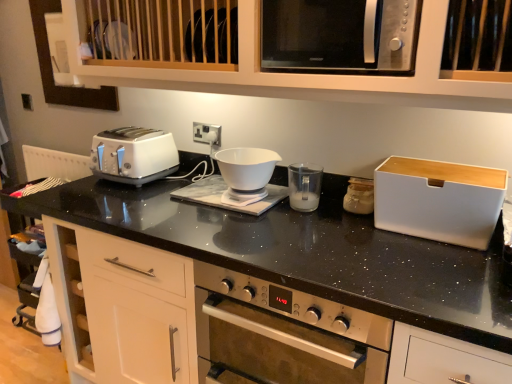
Question: From a real-world perspective, does white plastic bread bin at right, the 3th appliance when ordered from left to right, sit lower than matte glass jar at center-right, the second appliance when ordered from left to right?

Choices:
 (A) no
 (B) yes

Answer: (A)

Question: From the image's perspective, does white plastic bread bin at right, marked as the first appliance in a right-to-left arrangement, appear higher than matte glass jar at center-right, the second appliance when ordered from left to right?

Choices:
 (A) no
 (B) yes

Answer: (A)

Question: From the image's perspective, is white plastic bread bin at right, the 3th appliance when ordered from left to right, below matte glass jar at center-right, acting as the second appliance starting from the right?

Choices:
 (A) no
 (B) yes

Answer: (B)

Question: Could matte glass jar at center-right, acting as the second appliance starting from the right, be considered to be inside white plastic bread bin at right, the 3th appliance when ordered from left to right?

Choices:
 (A) no
 (B) yes

Answer: (A)

Question: Is white plastic bread bin at right, the 3th appliance when ordered from left to right, positioned behind matte glass jar at center-right, the second appliance when ordered from left to right?

Choices:
 (A) yes
 (B) no

Answer: (B)

Question: Is white plastic bread bin at right, the 3th appliance when ordered from left to right, shorter than matte glass jar at center-right, acting as the second appliance starting from the right?

Choices:
 (A) no
 (B) yes

Answer: (A)

Question: Can you confirm if white glossy bowl at center is bigger than white plastic cup at center, arranged as the first appliance when viewed from the left?

Choices:
 (A) yes
 (B) no

Answer: (A)

Question: From the image's perspective, does white glossy bowl at center appear lower than white plastic cup at center, arranged as the first appliance when viewed from the left?

Choices:
 (A) no
 (B) yes

Answer: (A)

Question: Can you confirm if white glossy bowl at center is smaller than white plastic cup at center, arranged as the first appliance when viewed from the left?

Choices:
 (A) no
 (B) yes

Answer: (A)

Question: Does white glossy bowl at center appear on the right side of white plastic cup at center, arranged as the first appliance when viewed from the left?

Choices:
 (A) no
 (B) yes

Answer: (A)

Question: Is white glossy bowl at center aimed at white plastic cup at center, arranged as the first appliance when viewed from the left?

Choices:
 (A) yes
 (B) no

Answer: (B)

Question: Does white glossy bowl at center have a lesser width compared to white plastic cup at center, marked as the third appliance in a right-to-left arrangement?

Choices:
 (A) no
 (B) yes

Answer: (A)

Question: Considering the relative sizes of white plastic toaster at left and white plastic cup at center, arranged as the first appliance when viewed from the left, in the image provided, is white plastic toaster at left thinner than white plastic cup at center, arranged as the first appliance when viewed from the left,?

Choices:
 (A) yes
 (B) no

Answer: (B)